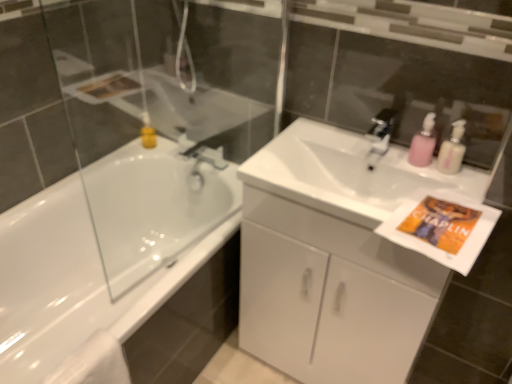
In order to click on free space in front of pink plastic pump at upper right in this screenshot , I will do `click(455, 197)`.